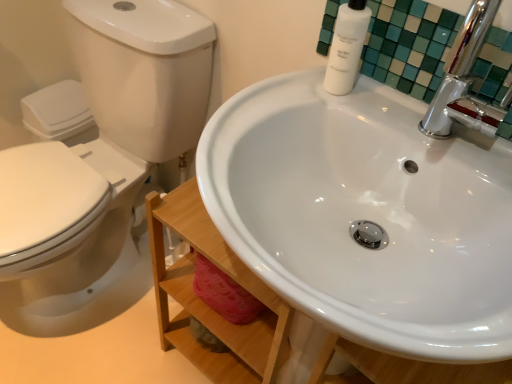
Locate an element on the screen. free spot to the right of white matte bottle at upper right is located at coordinates (410, 120).